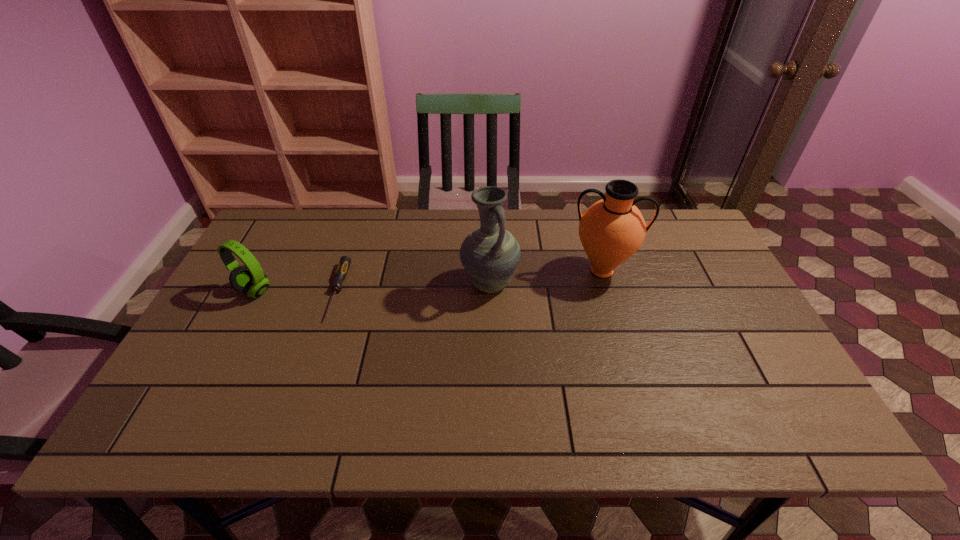
Where is `free space between the rightmost object and the left pitcher`? This screenshot has width=960, height=540. free space between the rightmost object and the left pitcher is located at coordinates (545, 277).

Identify the location of vacant region between the third object from left to right and the rightmost object. The height and width of the screenshot is (540, 960). (545, 277).

The height and width of the screenshot is (540, 960). I want to click on vacant space that is in between the rightmost object and the left pitcher, so click(x=545, y=277).

I want to click on empty location between the rightmost object and the shortest object, so (470, 281).

The height and width of the screenshot is (540, 960). Find the location of `free space that is in between the right pitcher and the headset`. free space that is in between the right pitcher and the headset is located at coordinates (428, 281).

This screenshot has width=960, height=540. I want to click on unoccupied area between the leftmost object and the third object from right to left, so click(296, 291).

You are a GUI agent. You are given a task and a screenshot of the screen. Output one action in this format:
    pyautogui.click(x=<x>, y=<y>)
    Task: Click on the vacant region between the third object from right to left and the right pitcher
    This screenshot has height=540, width=960.
    Given the screenshot: What is the action you would take?
    pyautogui.click(x=470, y=281)

I want to click on object identified as the closest to the shortest object, so click(x=249, y=278).

Image resolution: width=960 pixels, height=540 pixels. Find the location of `object identified as the third closest to the headset`. object identified as the third closest to the headset is located at coordinates (611, 230).